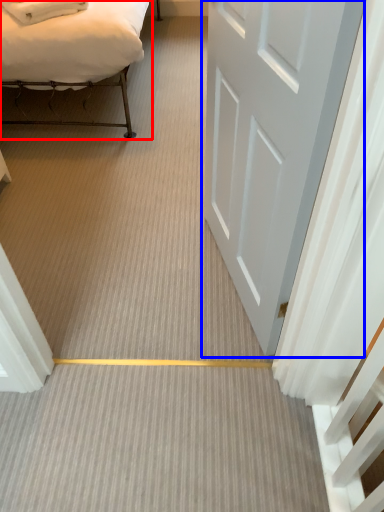
Question: Which of the following is the farthest to the observer, bed (highlighted by a red box) or door (highlighted by a blue box)?

Choices:
 (A) bed
 (B) door

Answer: (A)